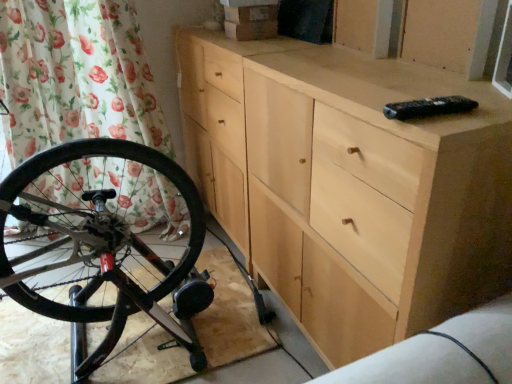
Locate an element on the screen. The height and width of the screenshot is (384, 512). free space behind clear glass window screen at upper right is located at coordinates (447, 72).